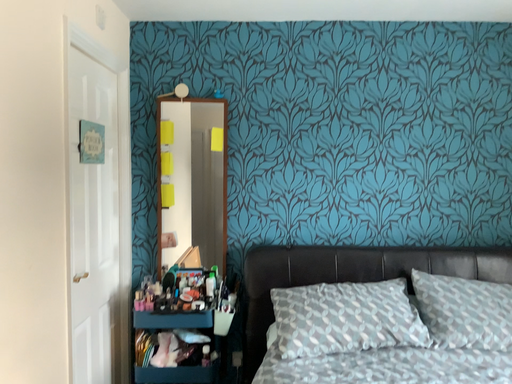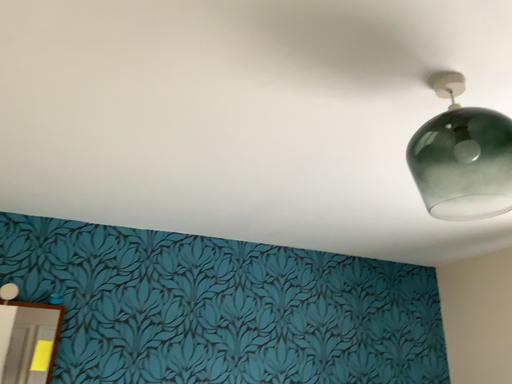
Question: Which way did the camera rotate in the video?

Choices:
 (A) rotated right
 (B) rotated left

Answer: (A)